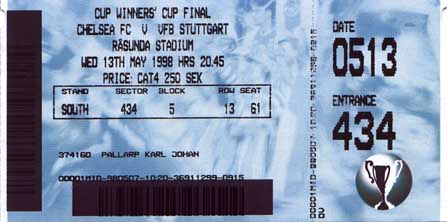
Locate an element on the screen. trophy is located at coordinates (386, 181).